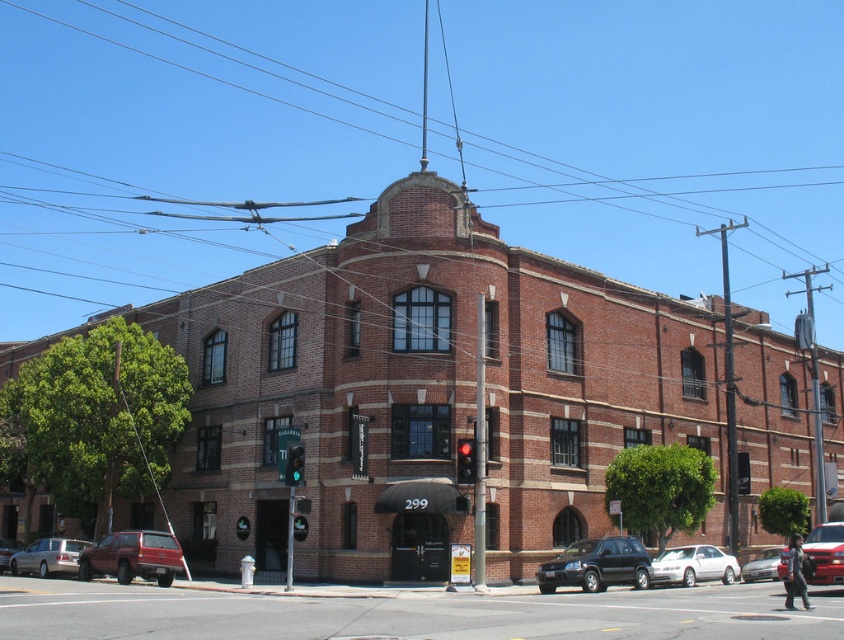
Which of these two, brick building at center or silver metallic sedan at center, stands taller?

With more height is brick building at center.

Between brick building at center and silver metallic sedan at center, which one is positioned higher?

brick building at center is higher up.

This screenshot has height=640, width=844. What do you see at coordinates (407, 612) in the screenshot? I see `brick building at center` at bounding box center [407, 612].

Identify the location of brick building at center. (407, 612).

Is point (165, 545) farther from camera compared to point (726, 554)?

No, (165, 545) is in front of (726, 554).

Is matte red suv at lower left thinner than white glossy sedan at center?

In fact, matte red suv at lower left might be wider than white glossy sedan at center.

Measure the distance between matte red suv at lower left and camera.

They are 40.64 meters apart.

I want to click on matte red suv at lower left, so click(x=133, y=556).

Does shiny black suv at center appear over red glass traffic light at center?

No.

Which is more to the right, shiny black suv at center or red glass traffic light at center?

Positioned to the right is shiny black suv at center.

Locate an element on the screen. shiny black suv at center is located at coordinates (596, 564).